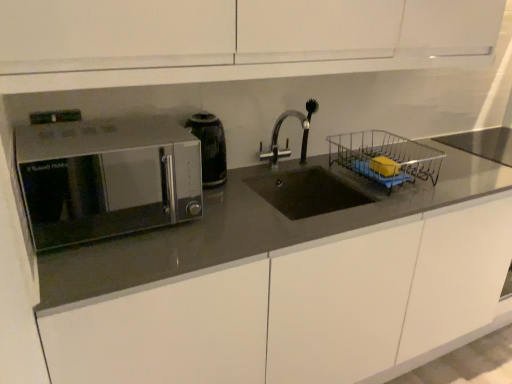
Locate an element on the screen. The height and width of the screenshot is (384, 512). free space on the front side of black glossy electric kettle at center-left is located at coordinates (218, 206).